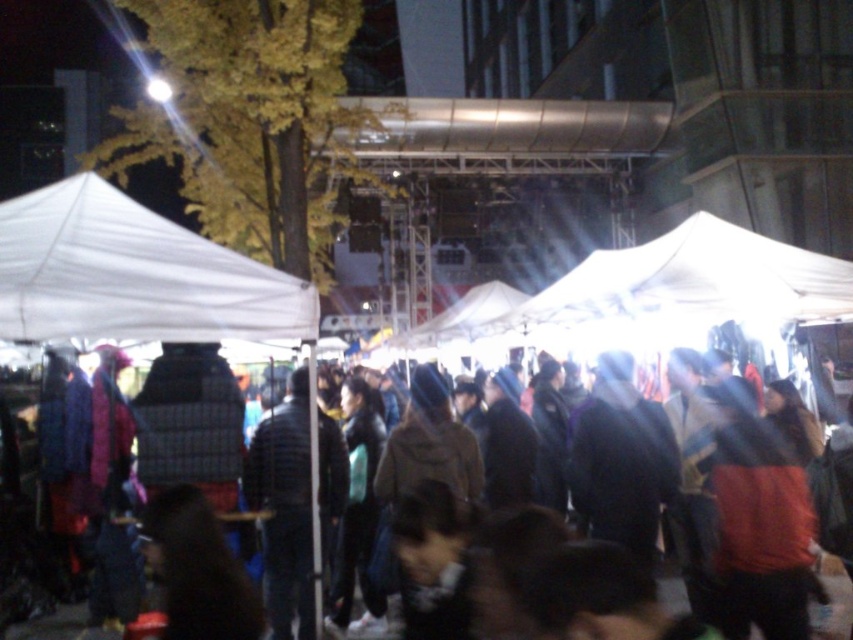
Question: Is the position of white fabric canopy at left more distant than that of brown fabric crowd at center?

Choices:
 (A) yes
 (B) no

Answer: (B)

Question: Does white fabric canopy at left have a smaller size compared to brown fabric crowd at center?

Choices:
 (A) no
 (B) yes

Answer: (B)

Question: In this image, where is white fabric canopy at left located relative to brown fabric crowd at center?

Choices:
 (A) above
 (B) below

Answer: (A)